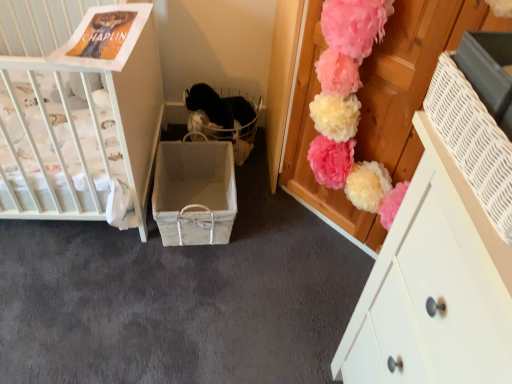
Where is `vacant area that lies in front of white wicker basket at center, which is the first storage box from back to front`? vacant area that lies in front of white wicker basket at center, which is the first storage box from back to front is located at coordinates (176, 286).